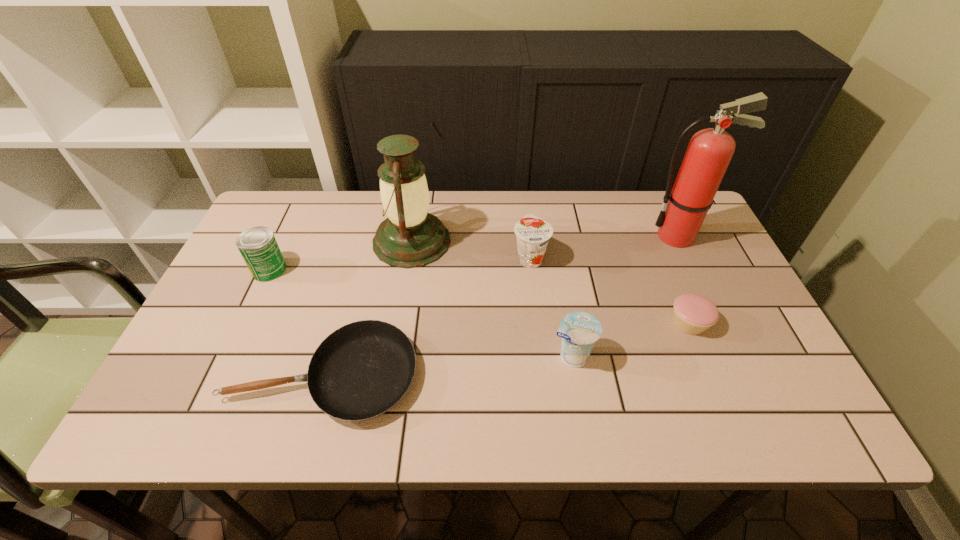
What are the coordinates of `free spot at the near left corner of the desktop` in the screenshot? It's located at (192, 417).

Where is `vacant space in between the second tallest object and the farther yogurt`? The image size is (960, 540). vacant space in between the second tallest object and the farther yogurt is located at coordinates (470, 249).

Image resolution: width=960 pixels, height=540 pixels. Find the location of `empty space between the tallest object and the nearer yogurt`. empty space between the tallest object and the nearer yogurt is located at coordinates (624, 296).

Locate an element on the screen. The image size is (960, 540). vacant space in between the cupcake and the farther yogurt is located at coordinates (610, 291).

Identify the location of vacant space in between the cupcake and the farther yogurt. Image resolution: width=960 pixels, height=540 pixels. (610, 291).

In order to click on free space between the nearer yogurt and the fire extinguisher in this screenshot , I will do `click(624, 296)`.

Where is `empty space between the second shortest object and the can`? The width and height of the screenshot is (960, 540). empty space between the second shortest object and the can is located at coordinates click(479, 296).

Locate an element on the screen. vacant space in between the sixth shortest object and the can is located at coordinates (341, 255).

Locate an element on the screen. Image resolution: width=960 pixels, height=540 pixels. vacant region between the farther yogurt and the shortest object is located at coordinates (427, 316).

At what (x,y) coordinates should I click in order to perform the action: click on free space between the can and the nearer yogurt. Please return your answer as a coordinate pair (x, y). Looking at the image, I should click on tap(420, 313).